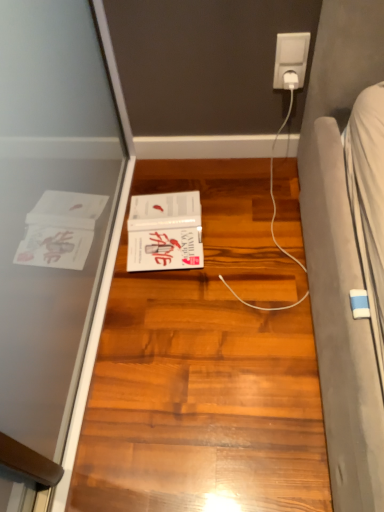
The height and width of the screenshot is (512, 384). Find the location of `white plastic power plug at upper right`. white plastic power plug at upper right is located at coordinates (291, 60).

This screenshot has height=512, width=384. What do you see at coordinates (291, 60) in the screenshot?
I see `white plastic power plug at upper right` at bounding box center [291, 60].

Identify the location of white plastic power plug at upper right. (291, 60).